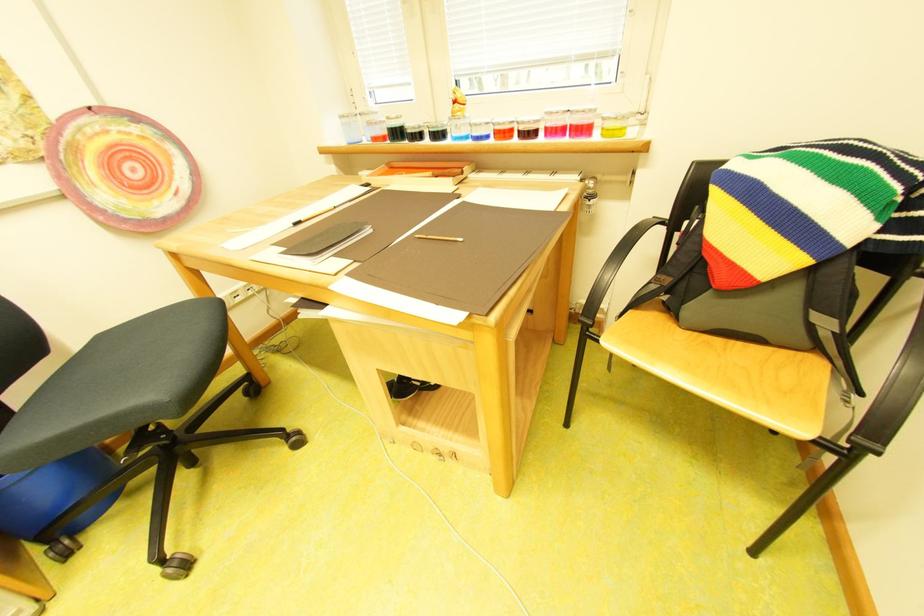
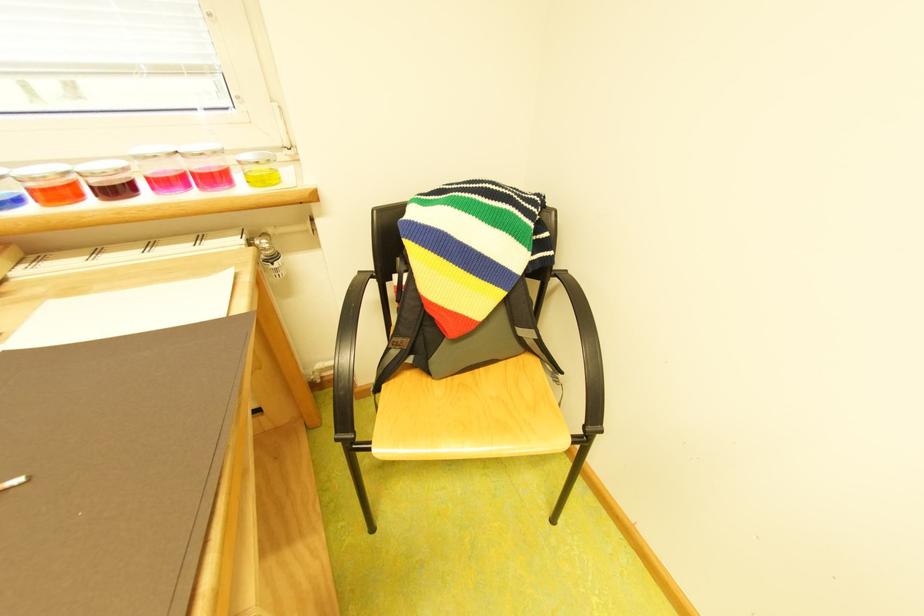
Locate, in the second image, the point that corresponds to point (714, 342) in the first image.

(469, 387)